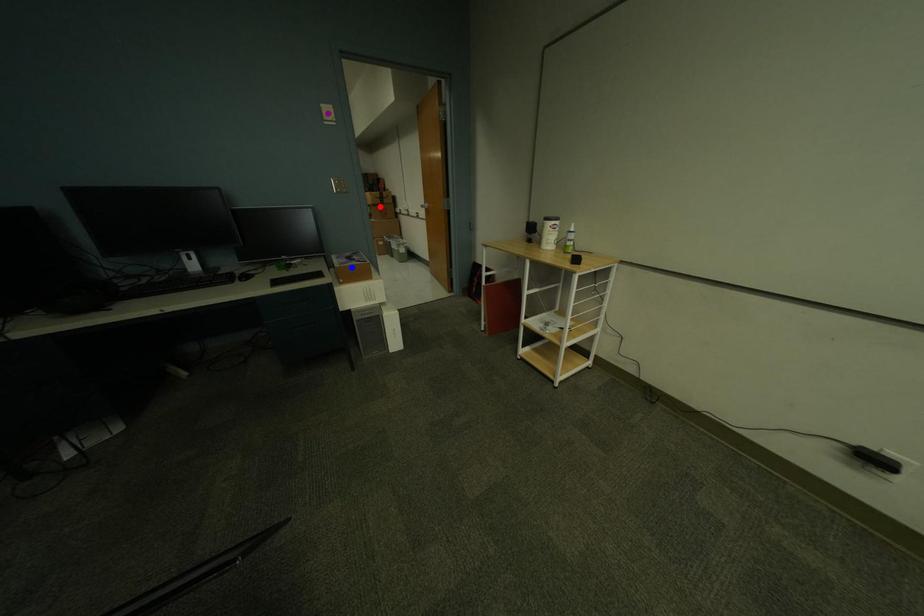
Order these from nearest to farthest:
blue point, red point, purple point

red point < blue point < purple point